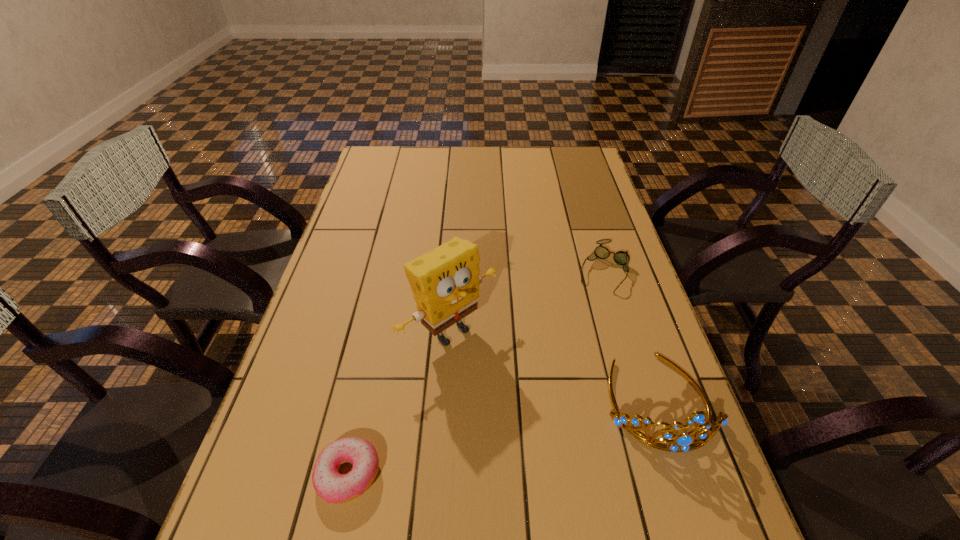
Where is `free space on the desktop that is between the leftmost object and the tiara and is positioned on the face of the sponge`? free space on the desktop that is between the leftmost object and the tiara and is positioned on the face of the sponge is located at coordinates (552, 427).

At what (x,y) coordinates should I click in order to perform the action: click on free spot on the desktop that is between the leftmost object and the second tallest object and is positioned on the front-facing side of the spectacles. Please return your answer as a coordinate pair (x, y). Image resolution: width=960 pixels, height=540 pixels. Looking at the image, I should click on [x=521, y=434].